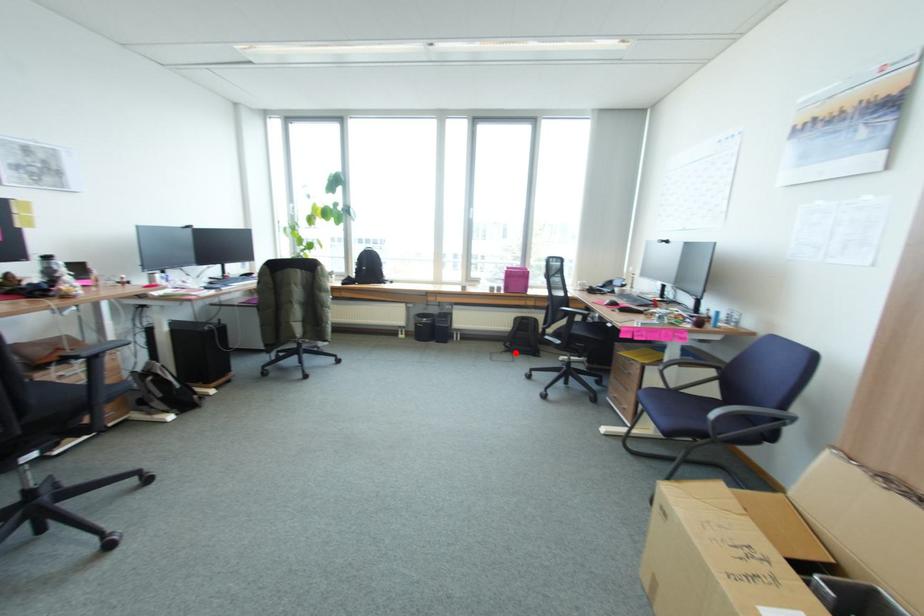
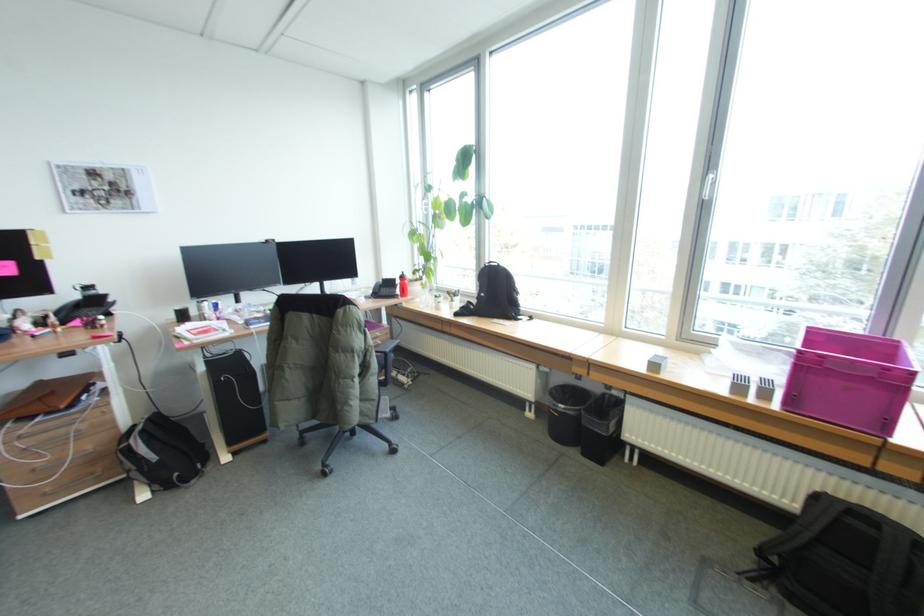
The point at the highlighted location is marked in the first image. Where is the corresponding point in the second image?

(781, 593)